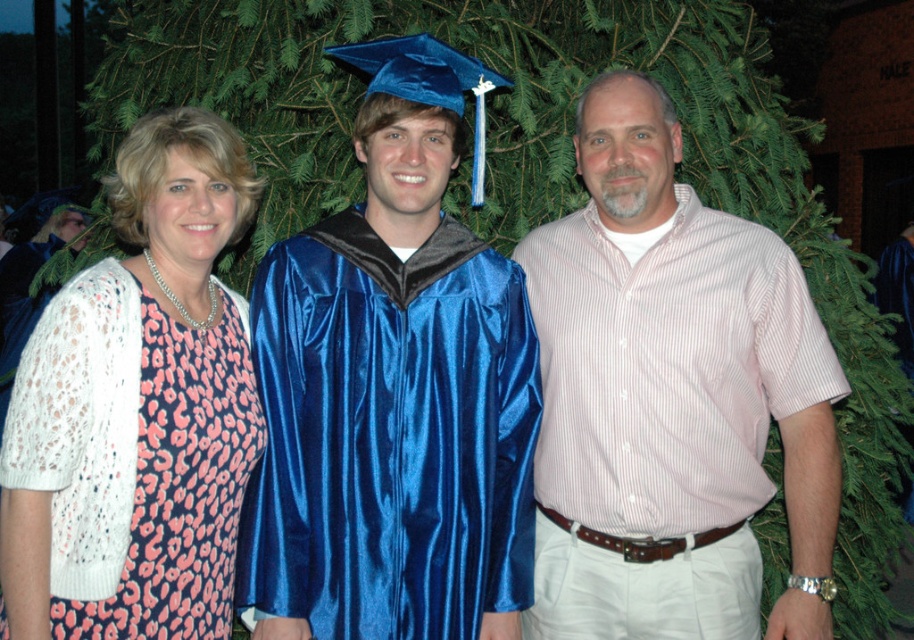
You are a photographer trying to capture a closeup of the pink striped shirt at center. Based on the coordinates provided, where should you focus your camera lens?

The pink striped shirt at center is located at point (671, 397), so you should focus your camera lens at those coordinates to capture a closeup.

You are a photographer at a graduation ceremony. You want to capture a photo of the shiny blue gown at center and the pink leopard print dress at left, ensuring both are in focus. The camera you are using has a depth of field that can cover 12 inches. Will both subjects be in focus?

The shiny blue gown at center and pink leopard print dress at left are 12.57 inches apart from each other. Since the depth of field can only cover 12 inches, the distance between them exceeds the camera setting, so both subjects may not be in focus simultaneously.